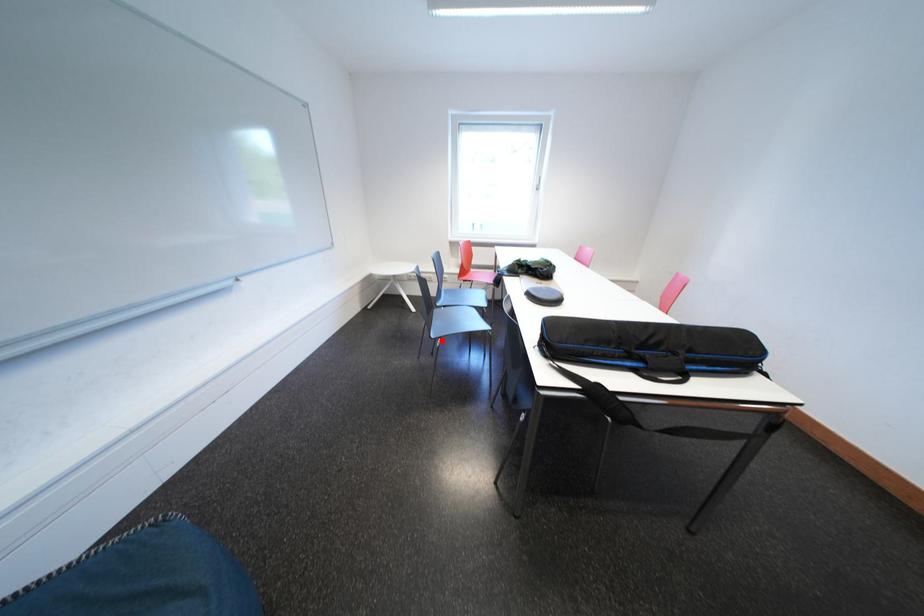
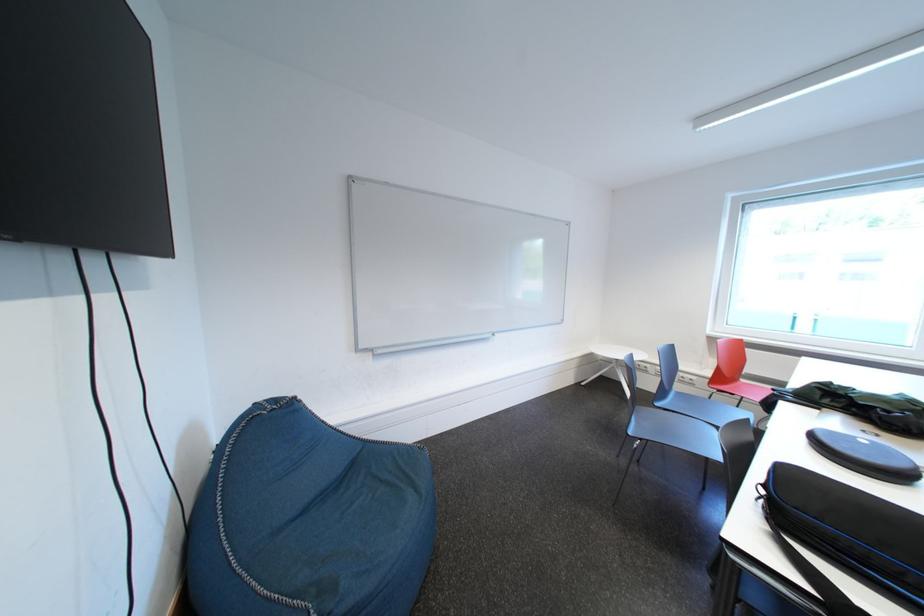
Question: I am providing you with two images of the same scene from different viewpoints. Image1 has a red point marked. In image2, the corresponding 3D location appears at what relative position? Reply with the corresponding letter.

Choices:
 (A) Closer
 (B) Farther

Answer: (B)